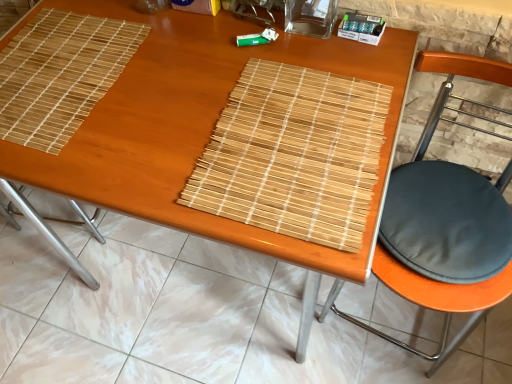
At what (x,y) coordinates should I click in order to perform the action: click on vacant space behind natural bamboo mat at center, which ranks as the first mat in right-to-left order. Please return your answer as a coordinate pair (x, y). Looking at the image, I should click on click(x=263, y=53).